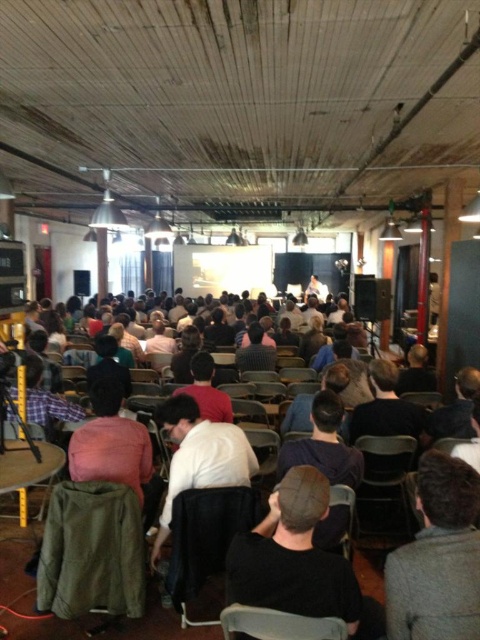
Question: Which point appears farthest from the camera in this image?

Choices:
 (A) (430, 385)
 (B) (411, 440)
 (C) (447, 509)

Answer: (A)

Question: Where is black fabric cap at center located in relation to olive-green fabric chair at lower left in the image?

Choices:
 (A) below
 (B) above

Answer: (B)

Question: Among these points, which one is farthest from the camera?

Choices:
 (A) click(x=243, y=429)
 (B) click(x=459, y=582)
 (C) click(x=230, y=605)

Answer: (A)

Question: Which point is closer to the camera?

Choices:
 (A) matte black chair at center
 (B) gray wool sweater at lower right
 (C) olive-green fabric chair at lower left
 (D) black fabric cap at center

Answer: (B)

Question: Is black fabric cap at center to the left of olive-green fabric chair at lower left from the viewer's perspective?

Choices:
 (A) no
 (B) yes

Answer: (A)

Question: Is olive-green fabric chair at lower left bigger than black plastic chair at center?

Choices:
 (A) yes
 (B) no

Answer: (B)